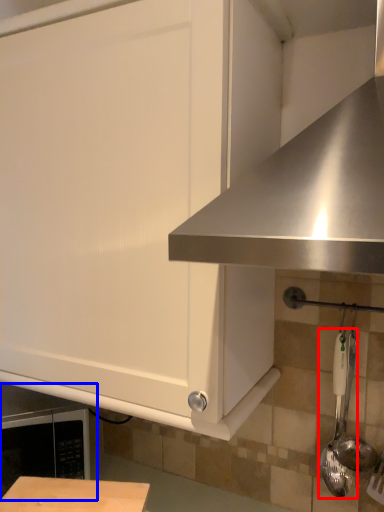
Question: Which of the following is the closest to the observer, utensil (highlighted by a red box) or appliance (highlighted by a blue box)?

Choices:
 (A) utensil
 (B) appliance

Answer: (A)